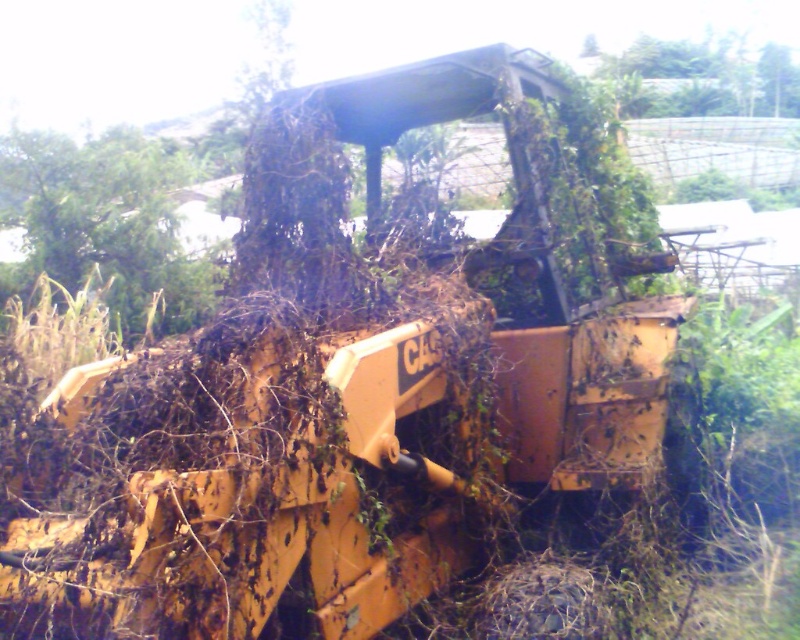
Based on the photo, you are a drone operator tasked with taking aerial photos of the abandoned CAT excavator. You need to fly between the green leafy tree at upper left and the green leafy tree at upper center to get the best angle. Can your drone, which has a maximum flight distance of 10 meters between waypoints, safely navigate this path?

The green leafy tree at upper left is 9.64 meters away from the green leafy tree at upper center. Since the drone can fly up to 10 meters between waypoints, it can safely navigate the path between them as the distance is within the maximum allowed range.

You are standing in front of the yellow Caterpillar excavator and looking at the two green leafy trees in the background. Which tree is closer to you, the green leafy tree at upper left or the green leafy tree at upper center?

The green leafy tree at upper left is closer to the viewer than the green leafy tree at upper center.